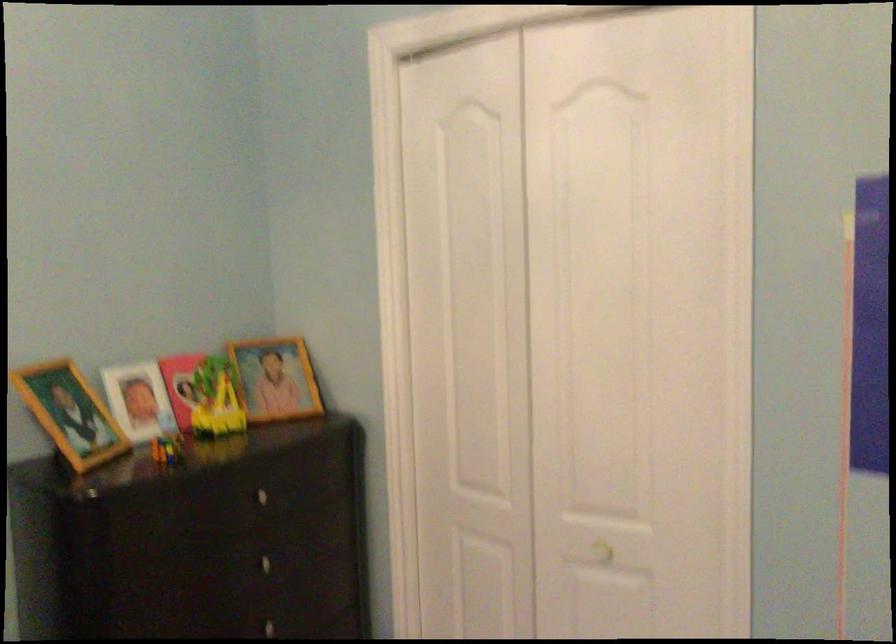
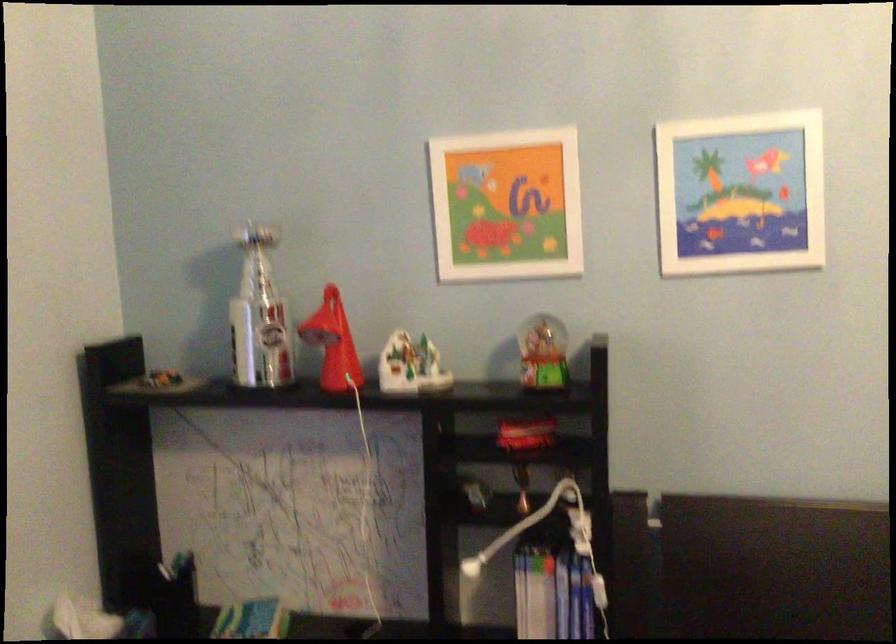
Question: The first image is from the beginning of the video and the second image is from the end. How did the camera likely rotate when shooting the video?

Choices:
 (A) Left
 (B) Right
 (C) Up
 (D) Down

Answer: (A)